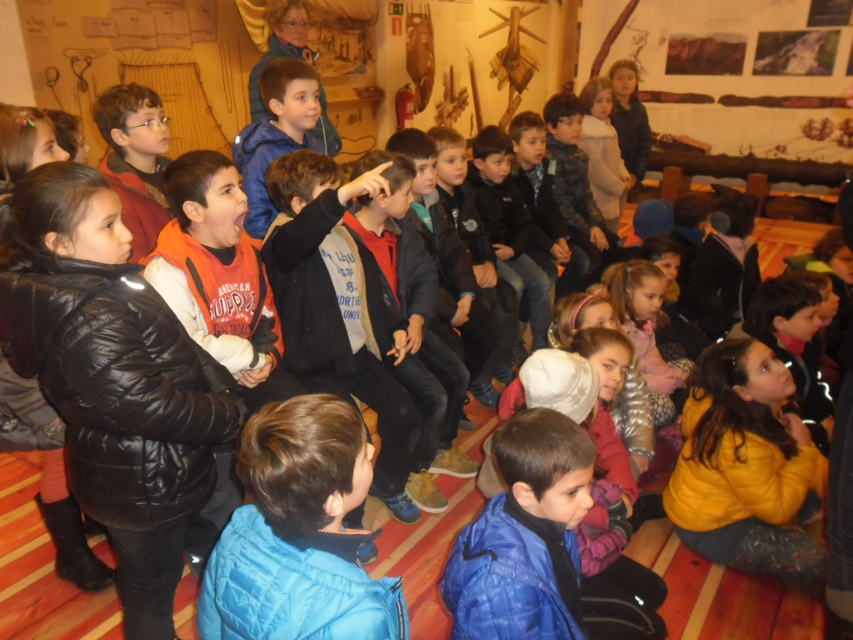
Consider the image. Who is positioned more to the left, blue quilted jacket at center or yellow fleece jacket at lower right?

blue quilted jacket at center is more to the left.

Does point (256, 552) come behind point (756, 436)?

No, it is not.

You are a GUI agent. You are given a task and a screenshot of the screen. Output one action in this format:
    pyautogui.click(x=<x>, y=<y>)
    Task: Click on the blue quilted jacket at center
    The image size is (853, 640).
    Given the screenshot: What is the action you would take?
    pyautogui.click(x=299, y=532)